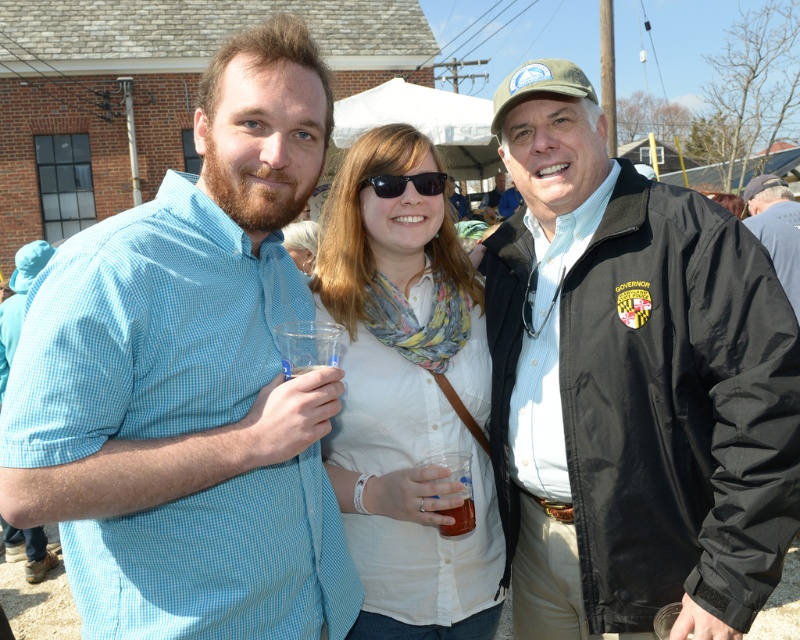
Question: Which point is closer to the camera?

Choices:
 (A) black plastic sunglasses at center
 (B) translucent plastic cup at center

Answer: (B)

Question: Among these objects, which one is farthest from the camera?

Choices:
 (A) translucent plastic cup at center
 (B) black plastic sunglasses at center
 (C) black nylon jacket at center

Answer: (B)

Question: From the image, what is the correct spatial relationship of black nylon jacket at center in relation to black jacket at right?

Choices:
 (A) below
 (B) above

Answer: (A)

Question: Among these points, which one is farthest from the camera?

Choices:
 (A) (752, 228)
 (B) (440, 525)
 (C) (184, 504)

Answer: (A)

Question: Does light blue checkered shirt at left lie in front of black plastic sunglasses at center?

Choices:
 (A) yes
 (B) no

Answer: (A)

Question: Can you confirm if white woven shirt at center is positioned below black plastic sunglasses at center?

Choices:
 (A) no
 (B) yes

Answer: (B)